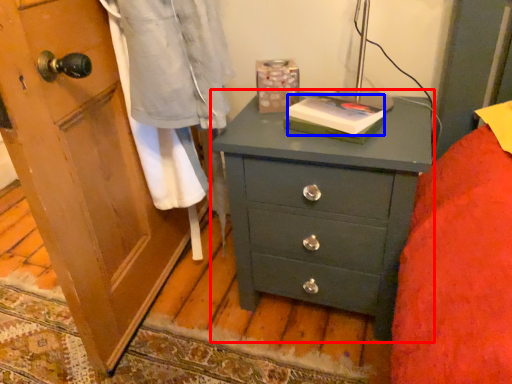
Question: Among these objects, which one is nearest to the camera, chest of drawers (highlighted by a red box) or book (highlighted by a blue box)?

Choices:
 (A) chest of drawers
 (B) book

Answer: (A)